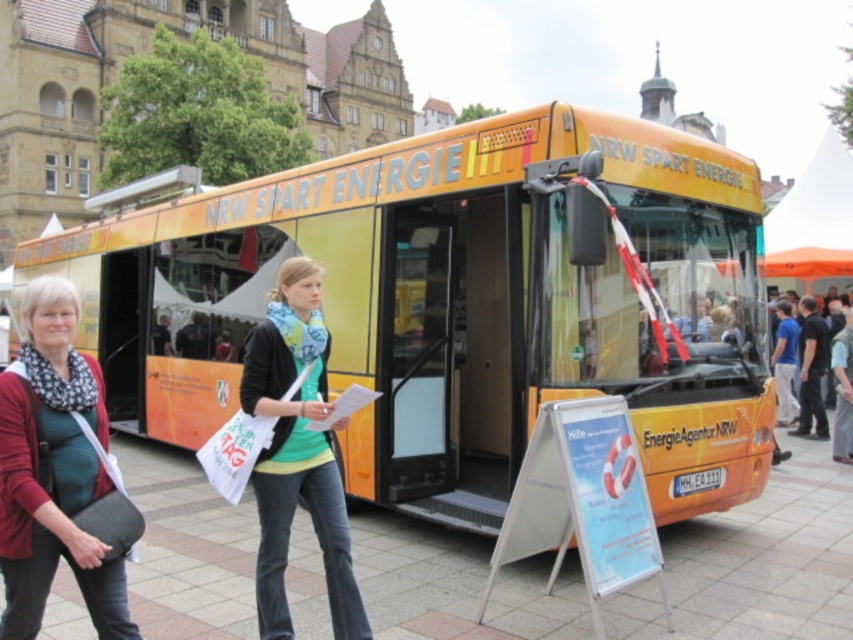
Question: Which point is closer to the camera?

Choices:
 (A) yellow matte bus at center
 (B) white plastic sign at lower center
 (C) light beige fabric pants at lower right

Answer: (B)

Question: Which object is farther from the camera taking this photo?

Choices:
 (A) matte black jacket at center
 (B) light beige fabric pants at lower right

Answer: (B)

Question: Which object is farther from the camera taking this photo?

Choices:
 (A) light beige fabric pants at lower right
 (B) matte black jacket at lower left

Answer: (A)

Question: Does matte black jacket at lower left have a greater width compared to white plastic sign at lower center?

Choices:
 (A) no
 (B) yes

Answer: (B)

Question: Is matte black jacket at lower left above light beige fabric pants at lower right?

Choices:
 (A) no
 (B) yes

Answer: (B)

Question: In this image, where is matte black jacket at lower left located relative to matte black jacket at center?

Choices:
 (A) right
 (B) left

Answer: (B)